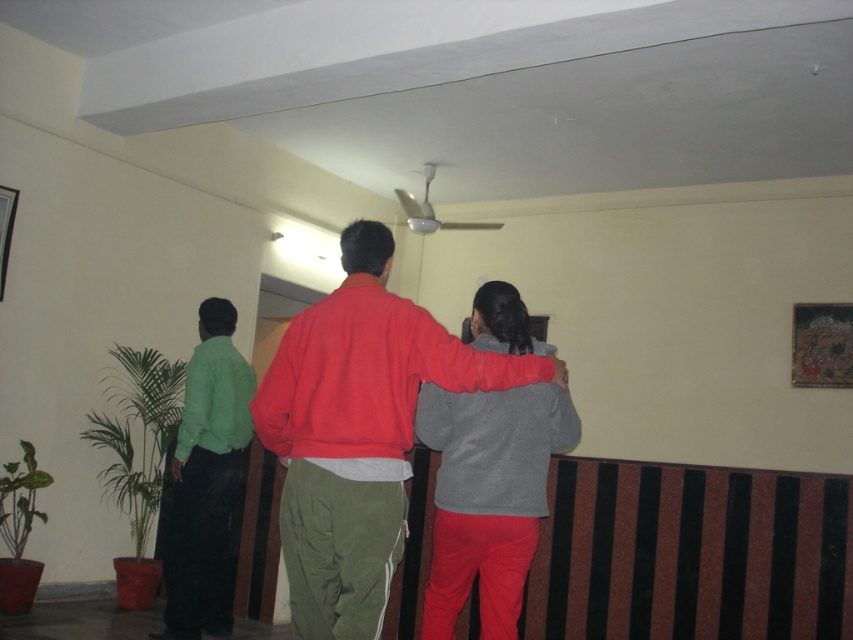
Can you confirm if red matte sweatshirt at center is wider than green fabric shirt at left?

Correct, the width of red matte sweatshirt at center exceeds that of green fabric shirt at left.

The width and height of the screenshot is (853, 640). I want to click on red matte sweatshirt at center, so click(x=358, y=432).

Locate an element on the screen. red matte sweatshirt at center is located at coordinates (358, 432).